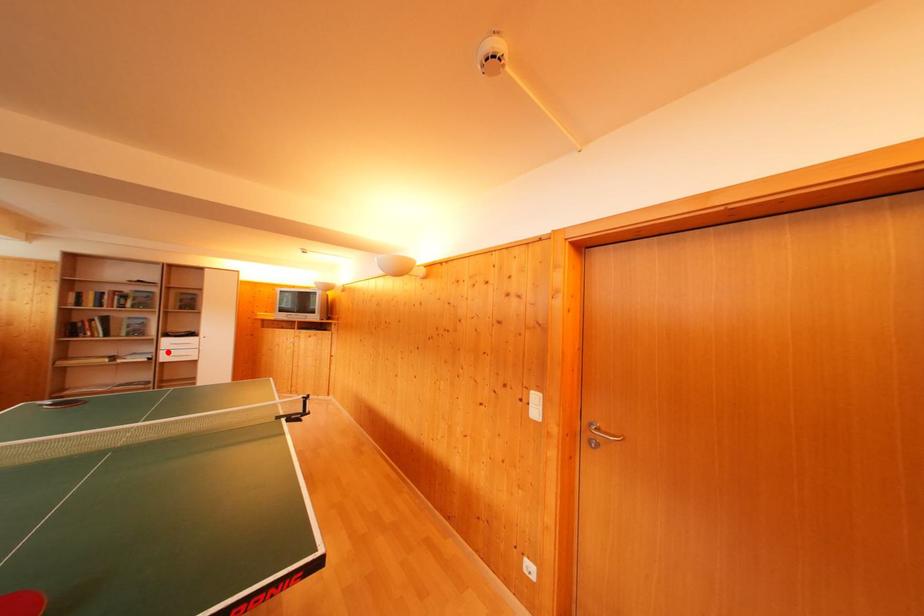
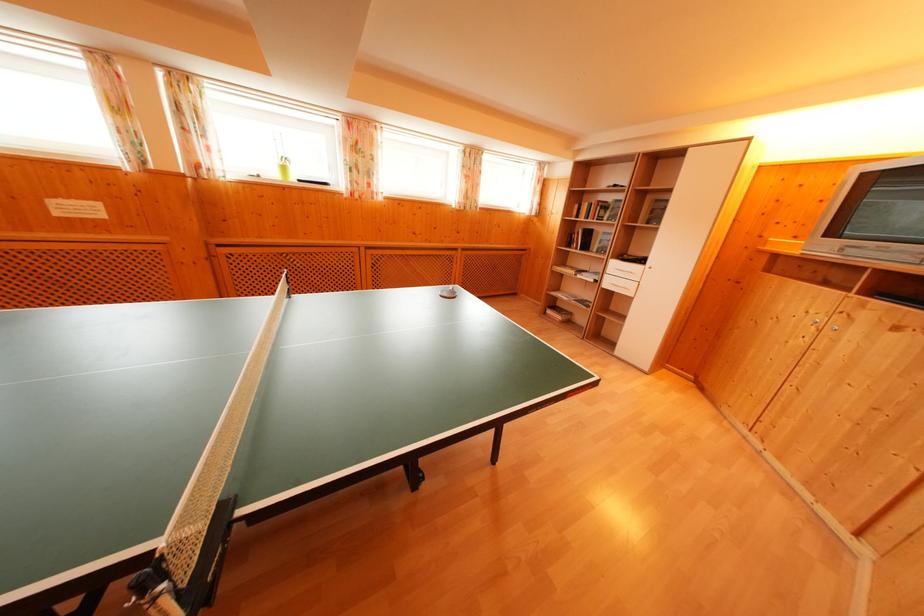
Question: I am providing you with two images of the same scene from different viewpoints. A red point is marked on the first image. Is the red point's position out of view in image 2?

Choices:
 (A) Yes
 (B) No

Answer: (B)